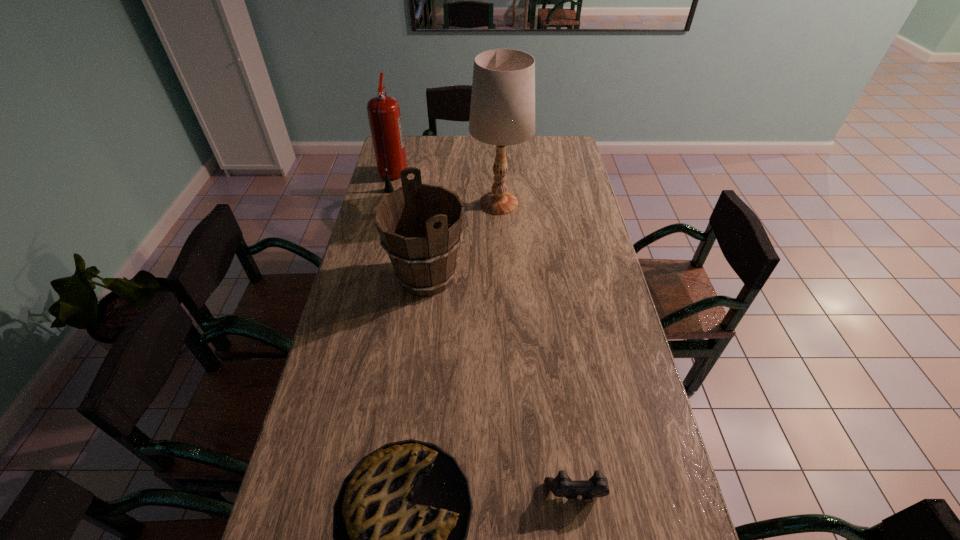
Point out which object is positioned as the third nearest to the pie. Please provide its 2D coordinates. Your answer should be formatted as a tuple, i.e. [(x, y)], where the tuple contains the x and y coordinates of a point satisfying the conditions above.

[(502, 112)]

This screenshot has width=960, height=540. I want to click on object identified as the third closest to the control, so click(502, 112).

Identify the location of vacant space that satisfies the following two spatial constraints: 1. on the back side of the tallest object; 2. on the left side of the third nearest object. Image resolution: width=960 pixels, height=540 pixels. tap(436, 204).

Identify the location of free region that satisfies the following two spatial constraints: 1. on the instruction side of the lamp; 2. on the right side of the fire extinguisher. The height and width of the screenshot is (540, 960). click(386, 204).

Where is `free spot that satisfies the following two spatial constraints: 1. on the instruction side of the fire extinguisher; 2. on the right side of the lamp`? This screenshot has width=960, height=540. free spot that satisfies the following two spatial constraints: 1. on the instruction side of the fire extinguisher; 2. on the right side of the lamp is located at coordinates (386, 204).